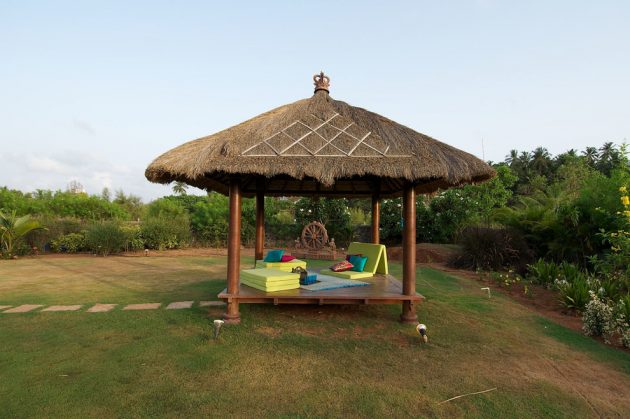
What are the coordinates of `seat cushion` in the screenshot? It's located at (375, 253), (273, 276), (288, 267).